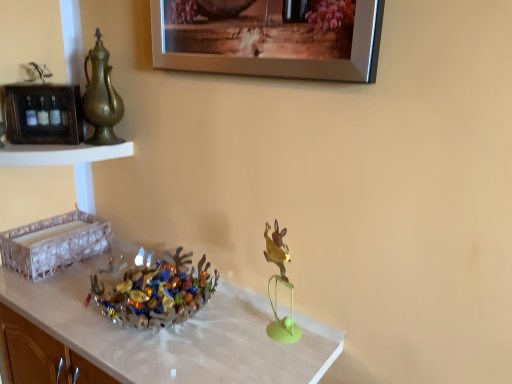
The height and width of the screenshot is (384, 512). In order to click on vacant space that's between metallic gold rabbit at center and translucent glass bowl at center in this screenshot , I will do `click(227, 333)`.